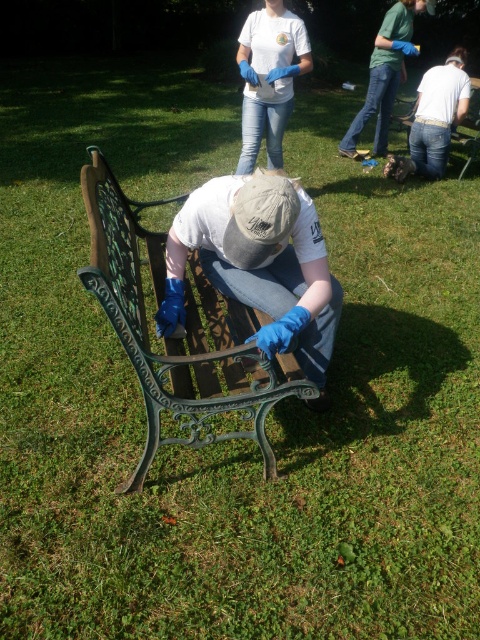
Question: Based on their relative distances, which object is farther from the green patinated metal bench at center?

Choices:
 (A) matte white t-shirt at upper center
 (B) matte black bench at center

Answer: (A)

Question: Is green patinated metal bench at center closer to the viewer compared to matte black bench at center?

Choices:
 (A) no
 (B) yes

Answer: (B)

Question: Considering the relative positions of green patinated metal bench at center and matte white t-shirt at upper center in the image provided, where is green patinated metal bench at center located with respect to matte white t-shirt at upper center?

Choices:
 (A) below
 (B) above

Answer: (A)

Question: Which of the following is the farthest from the observer?

Choices:
 (A) matte black bench at center
 (B) matte white t-shirt at upper center
 (C) green patinated metal bench at center

Answer: (B)

Question: Which point is closer to the camera?

Choices:
 (A) matte black bench at center
 (B) green patinated metal bench at center

Answer: (B)

Question: Does green patinated metal bench at center appear on the left side of matte white t-shirt at upper center?

Choices:
 (A) no
 (B) yes

Answer: (B)